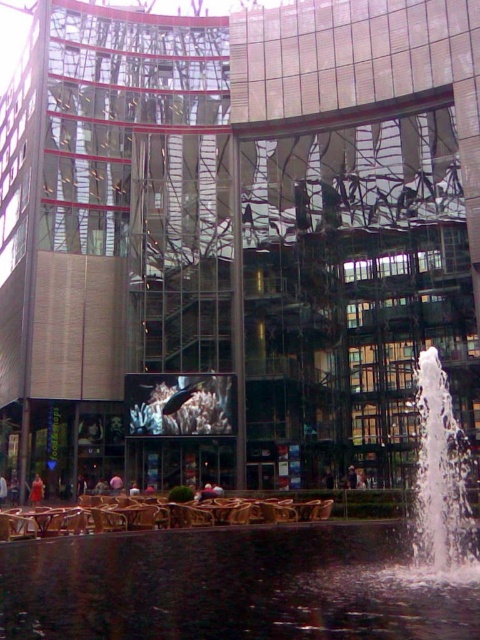
Which is below, black reflective water at lower center or brown wooden table at center?

brown wooden table at center is lower down.

What do you see at coordinates (231, 586) in the screenshot? I see `black reflective water at lower center` at bounding box center [231, 586].

Locate an element on the screen. The image size is (480, 640). black reflective water at lower center is located at coordinates (231, 586).

Can you confirm if white frothy water at lower right is positioned to the right of brown wooden table at center?

Yes, white frothy water at lower right is to the right of brown wooden table at center.

From the picture: Can you confirm if white frothy water at lower right is smaller than brown wooden table at center?

No, white frothy water at lower right is not smaller than brown wooden table at center.

Is point (453, 576) closer to camera compared to point (134, 518)?

That is True.

Find the location of a particular element. white frothy water at lower right is located at coordinates (439, 490).

Does brown wooden chairs at lower center have a greater height compared to brown wooden table at center?

Yes, brown wooden chairs at lower center is taller than brown wooden table at center.

Does point (10, 516) come in front of point (132, 516)?

That is True.

This screenshot has height=640, width=480. Identify the location of brown wooden chairs at lower center. 156,515.

This screenshot has height=640, width=480. Identify the location of brown wooden chairs at lower center. (156, 515).